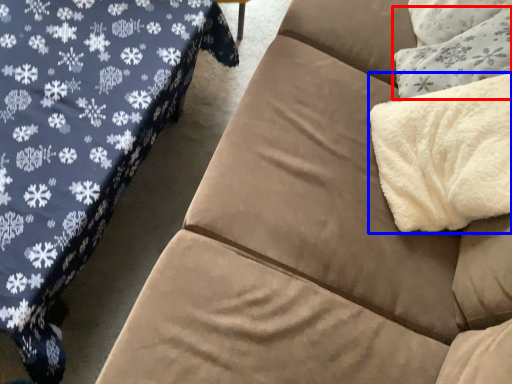
Question: Which object is further to the camera taking this photo, throw pillow (highlighted by a red box) or blanket (highlighted by a blue box)?

Choices:
 (A) throw pillow
 (B) blanket

Answer: (A)